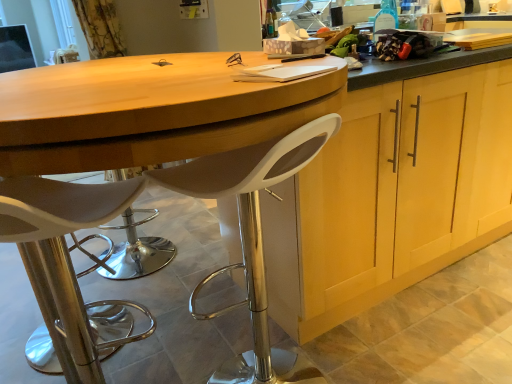
Identify the location of vacant space to the right of white plastic stool at center, the first chair when ordered from right to left. click(x=364, y=352).